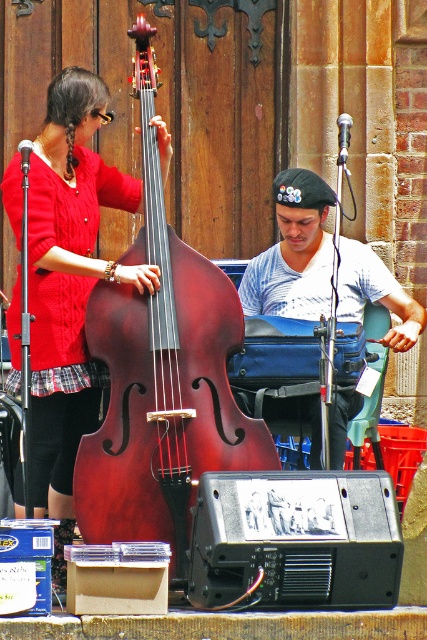
Who is more forward, (166, 301) or (75, 246)?

Positioned in front is point (166, 301).

Looking at this image, is shiny dark wood cello at center positioned at the back of matte red sweater at center?

No, it is not.

Who is more forward, (122, 472) or (78, 93)?

Point (122, 472)

Identify the location of shiny dark wood cello at center. click(x=161, y=376).

Can you confirm if matte red sweater at center is positioned to the right of striped cotton shirt at center?

Incorrect, matte red sweater at center is not on the right side of striped cotton shirt at center.

Is point (79, 97) farther from viewer compared to point (303, 260)?

No, (79, 97) is closer to viewer.

This screenshot has height=640, width=427. Identify the location of matte red sweater at center. (69, 276).

Locate an element on the screen. This screenshot has width=427, height=640. matte red sweater at center is located at coordinates (69, 276).

Can you confirm if shiny dark wood cello at center is positioned to the right of striped cotton shirt at center?

Result: No, shiny dark wood cello at center is not to the right of striped cotton shirt at center.

Which of these two, shiny dark wood cello at center or striped cotton shirt at center, stands taller?

Standing taller between the two is shiny dark wood cello at center.

Describe the element at coordinates (161, 376) in the screenshot. This screenshot has width=427, height=640. I see `shiny dark wood cello at center` at that location.

Identify the location of shiny dark wood cello at center. This screenshot has width=427, height=640. (161, 376).